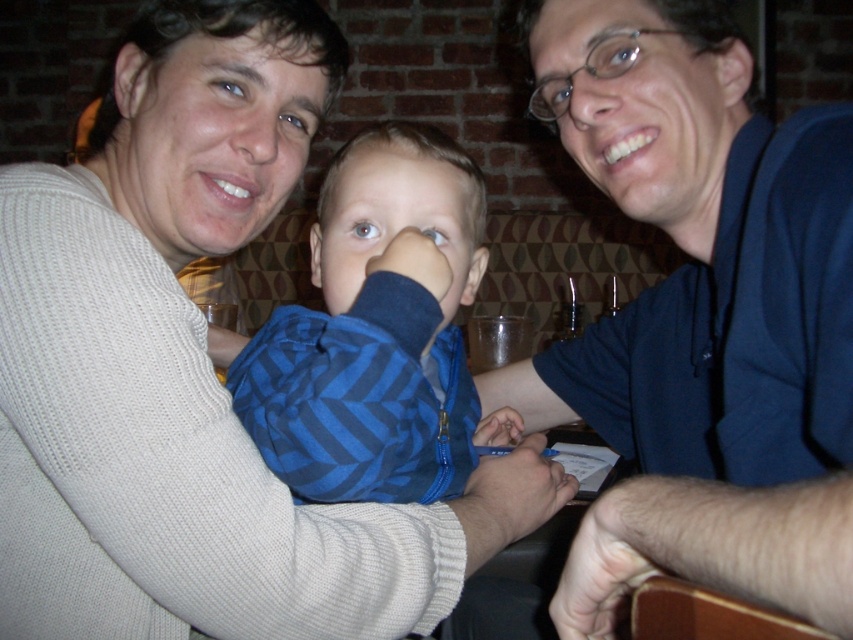
Question: Is white knit sweater at upper left closer to the viewer compared to blue striped shirt at center?

Choices:
 (A) no
 (B) yes

Answer: (B)

Question: Estimate the real-world distances between objects in this image. Which object is closer to the white knit sweater at upper left?

Choices:
 (A) blue shirt at center
 (B) blue striped shirt at center

Answer: (B)

Question: Observing the image, what is the correct spatial positioning of white knit sweater at upper left in reference to blue shirt at center?

Choices:
 (A) right
 (B) left

Answer: (B)

Question: Which of the following is the farthest from the observer?

Choices:
 (A) blue striped shirt at center
 (B) blue shirt at center
 (C) white knit sweater at upper left

Answer: (A)

Question: Can you confirm if white knit sweater at upper left is thinner than blue shirt at center?

Choices:
 (A) yes
 (B) no

Answer: (B)

Question: Among these points, which one is farthest from the camera?

Choices:
 (A) (289, 314)
 (B) (714, 225)
 (C) (262, 500)

Answer: (B)